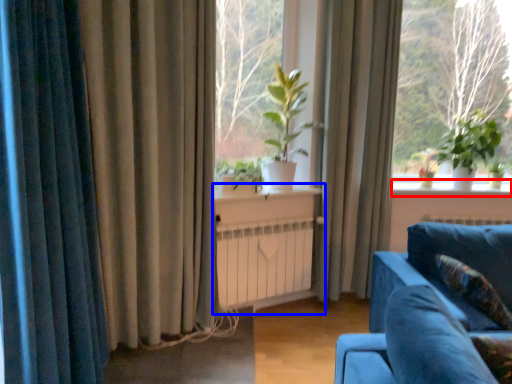
Question: Which object appears farthest to the camera in this image, window sill (highlighted by a red box) or table (highlighted by a blue box)?

Choices:
 (A) window sill
 (B) table

Answer: (A)